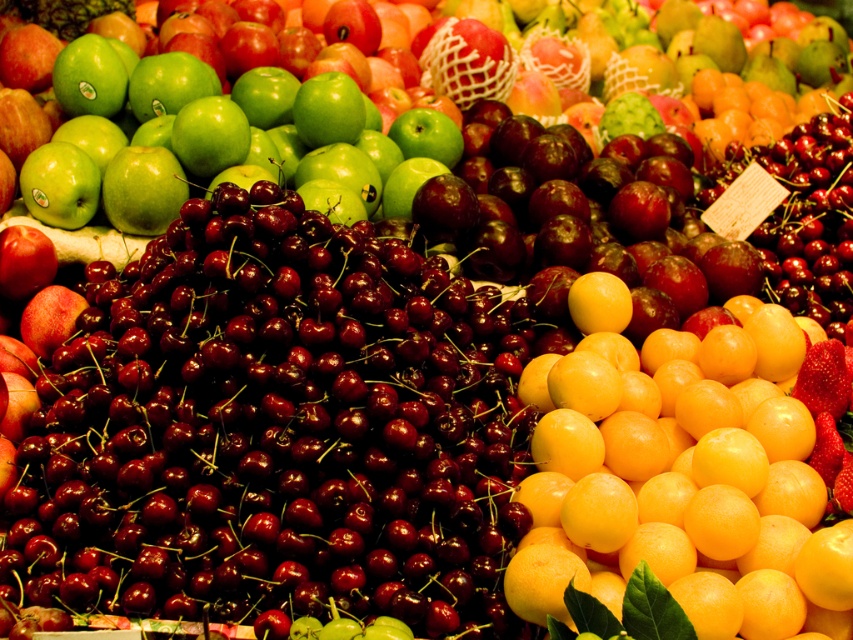
Question: Which point appears farthest from the camera in this image?

Choices:
 (A) (268, 92)
 (B) (781, 592)

Answer: (A)

Question: Does yellow matte/orange matte/orange smooth grapefruit at center have a lesser width compared to green matte apple at upper center?

Choices:
 (A) no
 (B) yes

Answer: (B)

Question: Does yellow matte/orange matte/orange smooth grapefruit at center have a smaller size compared to green matte apple at upper center?

Choices:
 (A) no
 (B) yes

Answer: (B)

Question: Which object is closer to the camera taking this photo?

Choices:
 (A) yellow matte/orange matte/orange smooth grapefruit at center
 (B) green matte apple at upper center

Answer: (A)

Question: Does yellow matte/orange matte/orange smooth grapefruit at center have a lesser width compared to green matte apple at upper center?

Choices:
 (A) yes
 (B) no

Answer: (A)